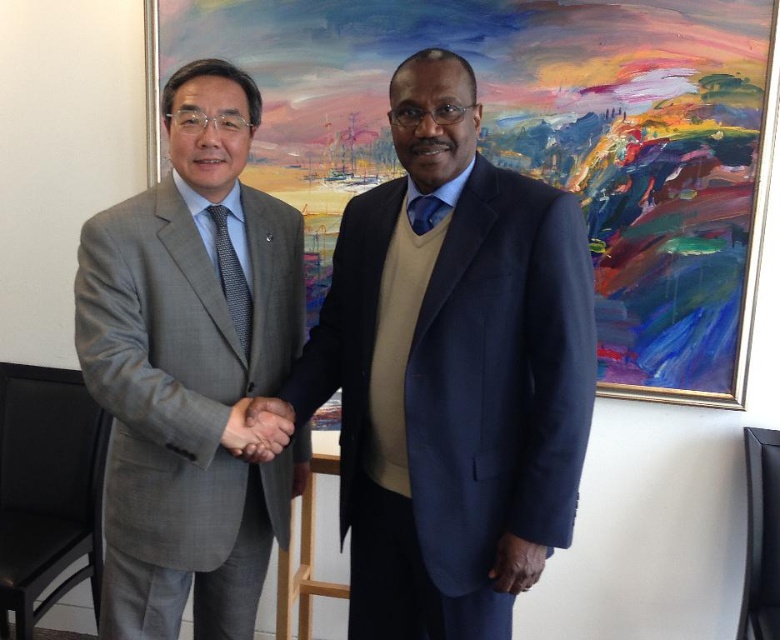
Question: Which point appears farthest from the camera in this image?

Choices:
 (A) (608, 253)
 (B) (151, 588)

Answer: (A)

Question: Can you confirm if oil painting at upper center is smaller than matte gray suit at center?

Choices:
 (A) no
 (B) yes

Answer: (A)

Question: Considering the relative positions of gray wool suit at left and dark brown leather hand at center in the image provided, where is gray wool suit at left located with respect to dark brown leather hand at center?

Choices:
 (A) above
 (B) below

Answer: (A)

Question: Which is nearer to the matte gray suit at center?

Choices:
 (A) dark brown leather hand at center
 (B) oil painting at upper center

Answer: (A)

Question: Which point is closer to the camera?

Choices:
 (A) (422, 202)
 (B) (220, 240)
 (C) (80, 340)

Answer: (C)

Question: In this image, where is oil painting at upper center located relative to matte gray suit at center?

Choices:
 (A) right
 (B) left

Answer: (A)